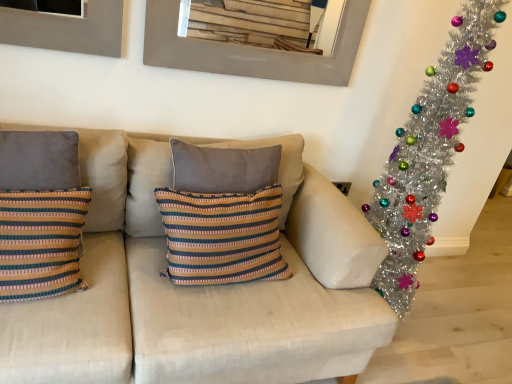
The width and height of the screenshot is (512, 384). What are the coordinates of `textured beige couch at center` in the screenshot? It's located at (201, 292).

This screenshot has width=512, height=384. Find the location of `shiny silver tinsel garland at right`. shiny silver tinsel garland at right is located at coordinates (428, 152).

Where is `metallic gray picture frame at upper center`? The height and width of the screenshot is (384, 512). metallic gray picture frame at upper center is located at coordinates (251, 50).

Would you consider metallic gray picture frame at upper center to be distant from striped fabric cushion at center, the second pillow positioned from the left?

No.

Is metallic gray picture frame at upper center smaller than striped fabric cushion at center, which is the first pillow from right to left?

Yes, metallic gray picture frame at upper center is smaller than striped fabric cushion at center, which is the first pillow from right to left.

Is metallic gray picture frame at upper center behind striped fabric cushion at center, which is the first pillow from right to left?

Yes, the depth of metallic gray picture frame at upper center is greater than that of striped fabric cushion at center, which is the first pillow from right to left.

Would you say metallic gray picture frame at upper center is outside striped fabric cushion at center, which is the first pillow from right to left?

metallic gray picture frame at upper center lies outside striped fabric cushion at center, which is the first pillow from right to left,'s area.

Which object is further away from the camera taking this photo, metallic gray picture frame at upper center or textured beige couch at center?

metallic gray picture frame at upper center is behind.

Is metallic gray picture frame at upper center facing away from textured beige couch at center?

No.

Is metallic gray picture frame at upper center surrounding textured beige couch at center?

Definitely not — textured beige couch at center is not inside metallic gray picture frame at upper center.

Considering the relative positions of shiny silver tinsel garland at right and striped fabric pillow at left, arranged as the second pillow when viewed from the right, in the image provided, is shiny silver tinsel garland at right to the left or to the right of striped fabric pillow at left, arranged as the second pillow when viewed from the right,?

From the image, it's evident that shiny silver tinsel garland at right is to the right of striped fabric pillow at left, arranged as the second pillow when viewed from the right.

From the image's perspective, who appears lower, shiny silver tinsel garland at right or striped fabric pillow at left, arranged as the second pillow when viewed from the right?

striped fabric pillow at left, arranged as the second pillow when viewed from the right, appears lower in the image.

Can you confirm if shiny silver tinsel garland at right is thinner than striped fabric pillow at left, the first pillow viewed from the left?

In fact, shiny silver tinsel garland at right might be wider than striped fabric pillow at left, the first pillow viewed from the left.

Does shiny silver tinsel garland at right lie behind striped fabric pillow at left, the first pillow viewed from the left?

Yes, it is behind striped fabric pillow at left, the first pillow viewed from the left.

Is metallic gray picture frame at upper center inside the boundaries of shiny silver tinsel garland at right, or outside?

metallic gray picture frame at upper center lies outside shiny silver tinsel garland at right.

Does metallic gray picture frame at upper center touch shiny silver tinsel garland at right?

They are not placed beside each other.

In terms of height, does metallic gray picture frame at upper center look taller or shorter compared to shiny silver tinsel garland at right?

In the image, metallic gray picture frame at upper center appears to be shorter than shiny silver tinsel garland at right.

Which object is wider, metallic gray picture frame at upper center or shiny silver tinsel garland at right?

Wider between the two is shiny silver tinsel garland at right.

In the scene shown: Is striped fabric cushion at center, the second pillow positioned from the left, aimed at shiny silver tinsel garland at right?

No, striped fabric cushion at center, the second pillow positioned from the left, does not turn towards shiny silver tinsel garland at right.

From the image's perspective, is striped fabric cushion at center, the second pillow positioned from the left, beneath shiny silver tinsel garland at right?

Yes, from the image's perspective, striped fabric cushion at center, the second pillow positioned from the left, is beneath shiny silver tinsel garland at right.

From a real-world perspective, between striped fabric cushion at center, which is the first pillow from right to left, and shiny silver tinsel garland at right, who is vertically higher?

shiny silver tinsel garland at right, from a real-world perspective.

Considering the positions of point (184, 47) and point (112, 153), is point (184, 47) closer or farther from the camera than point (112, 153)?

Clearly, point (184, 47) is more distant from the camera than point (112, 153).

Find the location of a particular element. This screenshot has height=384, width=512. picture frame behind the striped fabric pillow at left, the first pillow viewed from the left is located at coordinates (251, 50).

What's the angular difference between metallic gray picture frame at upper center and striped fabric pillow at left, the first pillow viewed from the left,'s facing directions?

0.115 degrees separate the facing orientations of metallic gray picture frame at upper center and striped fabric pillow at left, the first pillow viewed from the left.

Is metallic gray picture frame at upper center at the left side of striped fabric pillow at left, arranged as the second pillow when viewed from the right?

Incorrect, metallic gray picture frame at upper center is not on the left side of striped fabric pillow at left, arranged as the second pillow when viewed from the right.

Where is `studio couch directly beneath the striped fabric pillow at left, the first pillow viewed from the left (from a real-world perspective)`? The height and width of the screenshot is (384, 512). studio couch directly beneath the striped fabric pillow at left, the first pillow viewed from the left (from a real-world perspective) is located at coordinates click(x=201, y=292).

Who is bigger, striped fabric pillow at left, the first pillow viewed from the left, or textured beige couch at center?

Bigger between the two is textured beige couch at center.

Could you tell me if striped fabric pillow at left, arranged as the second pillow when viewed from the right, is facing textured beige couch at center?

Result: Yes, striped fabric pillow at left, arranged as the second pillow when viewed from the right, is aimed at textured beige couch at center.

From the image's perspective, between striped fabric pillow at left, arranged as the second pillow when viewed from the right, and textured beige couch at center, which one is located above?

striped fabric pillow at left, arranged as the second pillow when viewed from the right.

You are a GUI agent. You are given a task and a screenshot of the screen. Output one action in this format:
    pyautogui.click(x=<x>, y=<y>)
    Task: Click on the 2nd pillow below when counting from the metallic gray picture frame at upper center (from the image's perspective)
    The image size is (512, 384).
    Given the screenshot: What is the action you would take?
    pyautogui.click(x=146, y=185)

Locate an element on the screen. picture frame that is behind the textured beige couch at center is located at coordinates pyautogui.click(x=251, y=50).

Considering their positions, is striped fabric pillow at left, arranged as the second pillow when viewed from the right, positioned further to textured beige couch at center than striped fabric cushion at center, the second pillow positioned from the left?

striped fabric pillow at left, arranged as the second pillow when viewed from the right, is positioned further to the anchor textured beige couch at center.

Consider the image. Looking at the image, which one is located further to shiny silver tinsel garland at right, striped fabric pillow at left, the first pillow viewed from the left, or textured beige couch at center?

striped fabric pillow at left, the first pillow viewed from the left, lies further to shiny silver tinsel garland at right than the other object.

From the image, which object appears to be nearer to metallic gray picture frame at upper center, shiny silver tinsel garland at right or striped fabric pillow at left, arranged as the second pillow when viewed from the right?

The object closer to metallic gray picture frame at upper center is striped fabric pillow at left, arranged as the second pillow when viewed from the right.

Based on their spatial positions, is striped fabric cushion at center, the second pillow positioned from the left, or striped fabric pillow at left, arranged as the second pillow when viewed from the right, further from shiny silver tinsel garland at right?

striped fabric pillow at left, arranged as the second pillow when viewed from the right, is positioned further to the anchor shiny silver tinsel garland at right.

When comparing their distances from striped fabric cushion at center, the second pillow positioned from the left, does shiny silver tinsel garland at right or striped fabric pillow at left, the first pillow viewed from the left, seem further?

shiny silver tinsel garland at right.

Looking at the image, which one is located further to striped fabric cushion at center, which is the first pillow from right to left, striped fabric pillow at left, arranged as the second pillow when viewed from the right, or shiny silver tinsel garland at right?

Among the two, shiny silver tinsel garland at right is located further to striped fabric cushion at center, which is the first pillow from right to left.

Looking at the image, which one is located closer to metallic gray picture frame at upper center, textured beige couch at center or striped fabric cushion at center, which is the first pillow from right to left?

Among the two, striped fabric cushion at center, which is the first pillow from right to left, is located nearer to metallic gray picture frame at upper center.

Looking at the image, which one is located further to shiny silver tinsel garland at right, striped fabric pillow at left, arranged as the second pillow when viewed from the right, or striped fabric cushion at center, which is the first pillow from right to left?

striped fabric pillow at left, arranged as the second pillow when viewed from the right.

You are a GUI agent. You are given a task and a screenshot of the screen. Output one action in this format:
    pyautogui.click(x=<x>, y=<y>)
    Task: Click on the studio couch situated between striped fabric pillow at left, arranged as the second pillow when viewed from the right, and striped fabric cushion at center, which is the first pillow from right to left, from left to right
    Image resolution: width=512 pixels, height=384 pixels.
    Given the screenshot: What is the action you would take?
    pyautogui.click(x=201, y=292)

Image resolution: width=512 pixels, height=384 pixels. I want to click on pillow located between textured beige couch at center and shiny silver tinsel garland at right in the left-right direction, so click(146, 185).

Locate an element on the screen. The image size is (512, 384). studio couch situated between striped fabric pillow at left, the first pillow viewed from the left, and shiny silver tinsel garland at right from left to right is located at coordinates (201, 292).

This screenshot has height=384, width=512. Identify the location of pillow situated between striped fabric pillow at left, the first pillow viewed from the left, and shiny silver tinsel garland at right from left to right. (146, 185).